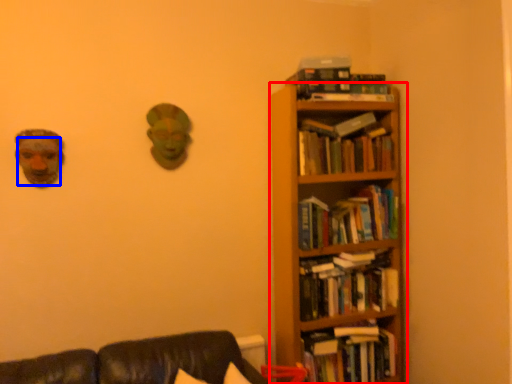
Question: Which point is closer to the camera, bookcase (highlighted by a red box) or human face (highlighted by a blue box)?

Choices:
 (A) bookcase
 (B) human face

Answer: (B)